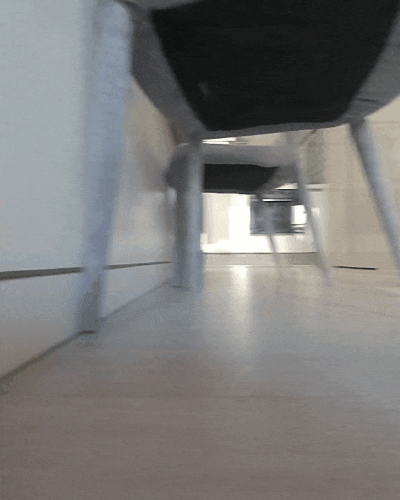
Where is `stove`? stove is located at coordinates (260, 221).